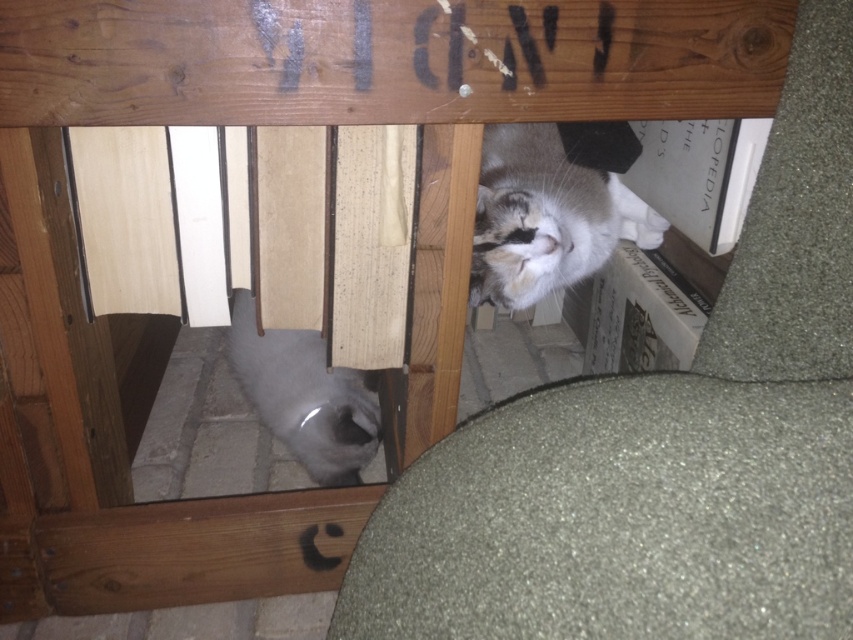
Question: Does soft gray cat at center appear on the right side of gray fur cat at lower left?

Choices:
 (A) no
 (B) yes

Answer: (B)

Question: Estimate the real-world distances between objects in this image. Which object is farther from the gray fur cat at lower left?

Choices:
 (A) soft gray cat at center
 (B) white fur cat at upper right

Answer: (A)

Question: Among these objects, which one is farthest from the camera?

Choices:
 (A) gray fur cat at lower left
 (B) white fur cat at upper right
 (C) soft gray cat at center

Answer: (A)

Question: Based on their relative distances, which object is farther from the soft gray cat at center?

Choices:
 (A) white fur cat at upper right
 (B) gray fur cat at lower left

Answer: (B)

Question: Is soft gray cat at center to the right of white fur cat at upper right from the viewer's perspective?

Choices:
 (A) yes
 (B) no

Answer: (A)

Question: Can you confirm if white fur cat at upper right is positioned below gray fur cat at lower left?

Choices:
 (A) no
 (B) yes

Answer: (A)